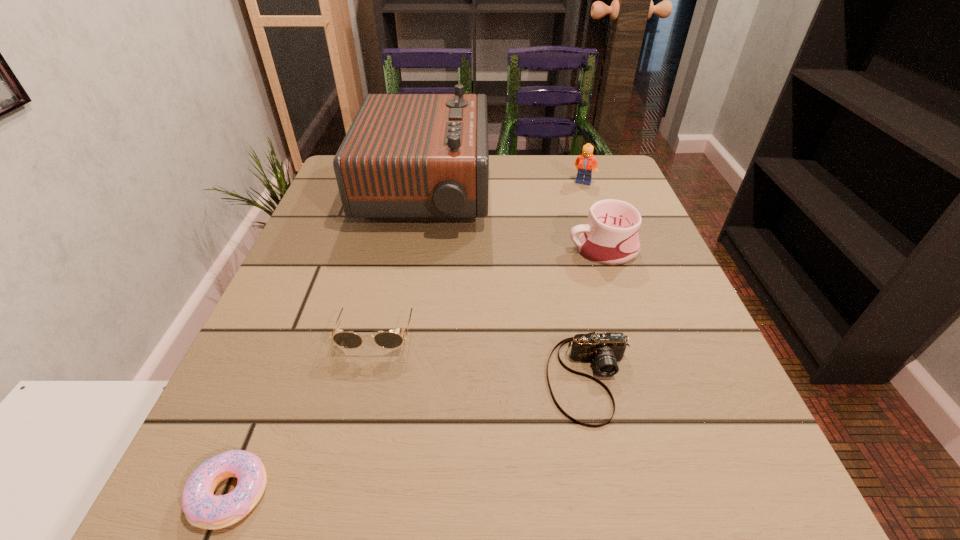
Find the location of a particular element. The width and height of the screenshot is (960, 540). radio receiver is located at coordinates (406, 157).

At what (x,y) coordinates should I click in order to perform the action: click on Lego. Please return your answer as a coordinate pair (x, y). Looking at the image, I should click on (586, 162).

Find the location of a particular element. mug is located at coordinates (610, 236).

The height and width of the screenshot is (540, 960). Identify the location of sunglasses. (389, 340).

This screenshot has width=960, height=540. I want to click on the second shortest object, so click(605, 349).

The width and height of the screenshot is (960, 540). Identify the location of the nearest object. (202, 509).

At what (x,y) coordinates should I click in order to perform the action: click on doughnut. Please return your answer as a coordinate pair (x, y). Looking at the image, I should click on pos(202,509).

Locate an element on the screen. vacant space located on the front panel of the radio receiver is located at coordinates (619, 193).

Locate an element on the screen. The image size is (960, 540). free space located 0.150m on the front-facing side of the Lego is located at coordinates (x=596, y=220).

Where is `free space located on the side with the handle of the mug`? This screenshot has height=540, width=960. free space located on the side with the handle of the mug is located at coordinates (441, 249).